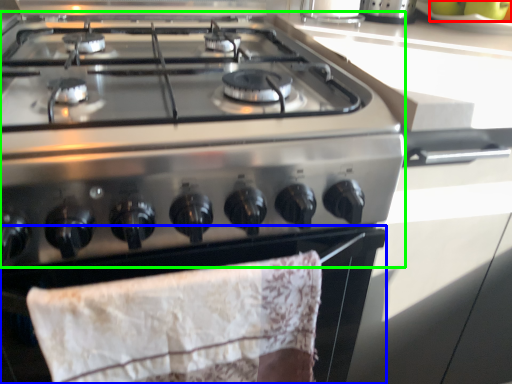
Question: Considering the real-world distances, which object is farthest from fruit (highlighted by a red box)? oven (highlighted by a blue box) or gas stove (highlighted by a green box)?

Choices:
 (A) oven
 (B) gas stove

Answer: (A)